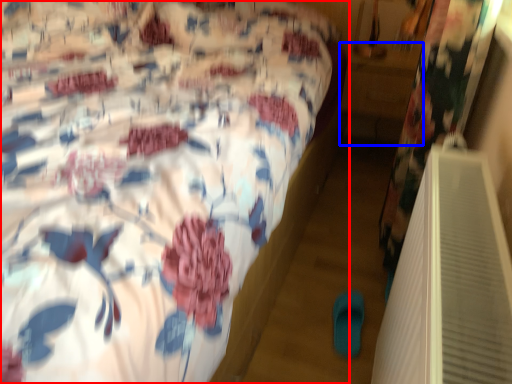
Question: Among these objects, which one is farthest to the camera, bed (highlighted by a red box) or table (highlighted by a blue box)?

Choices:
 (A) bed
 (B) table

Answer: (B)